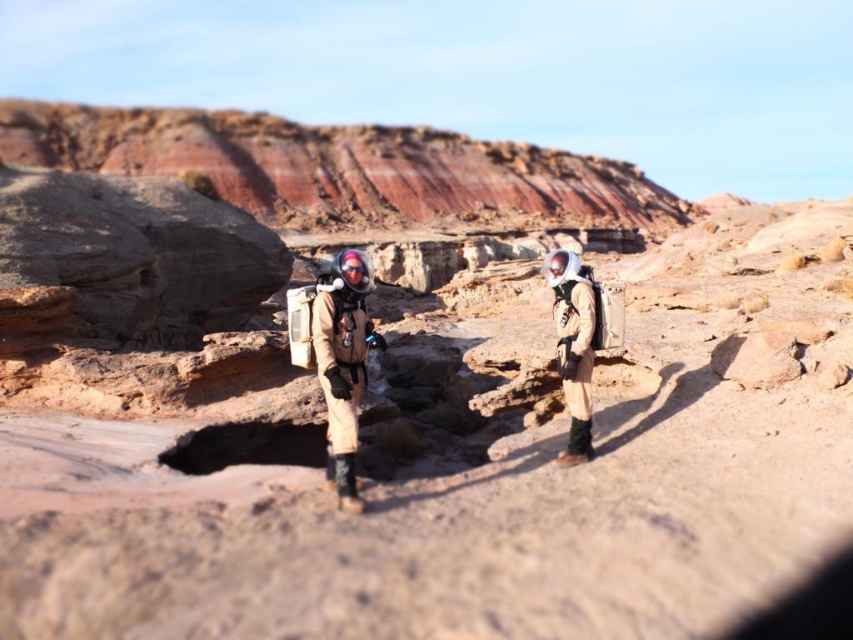
Is tan fabric spacesuit at center below matte beige spacesuit at right?

Correct, tan fabric spacesuit at center is located below matte beige spacesuit at right.

The height and width of the screenshot is (640, 853). I want to click on tan fabric spacesuit at center, so pyautogui.click(x=341, y=364).

Image resolution: width=853 pixels, height=640 pixels. In order to click on tan fabric spacesuit at center in this screenshot , I will do `click(341, 364)`.